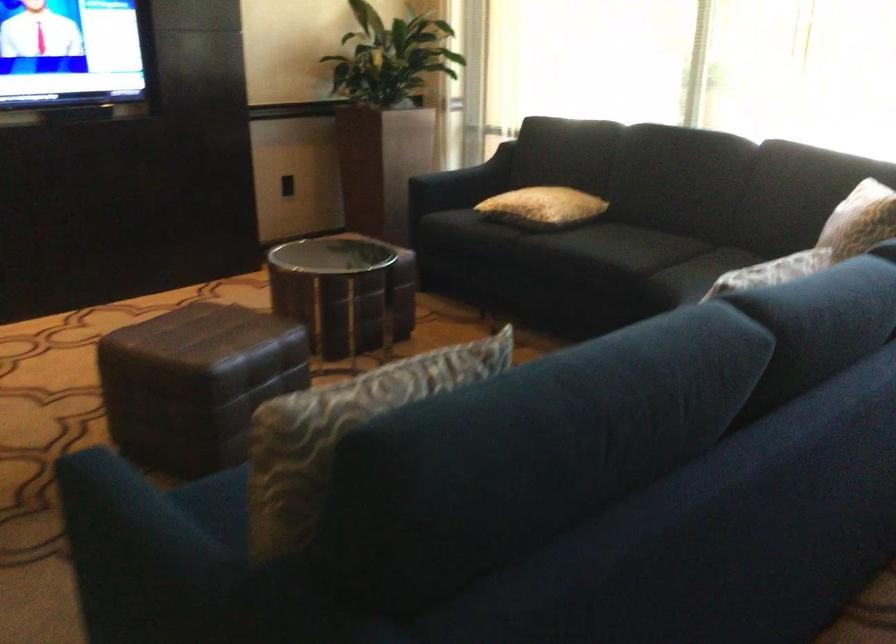
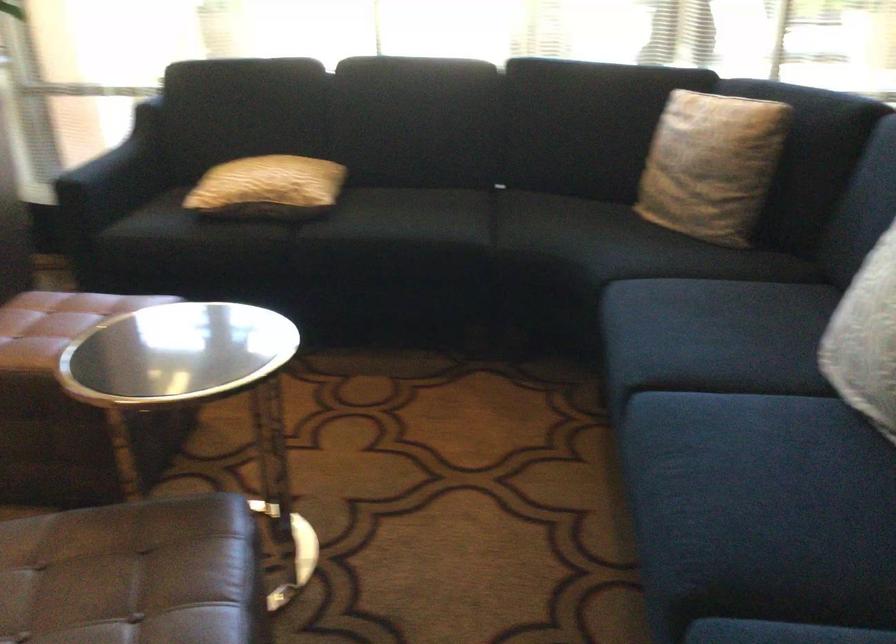
The point at (x=521, y=204) is marked in the first image. Where is the corresponding point in the second image?

(268, 187)